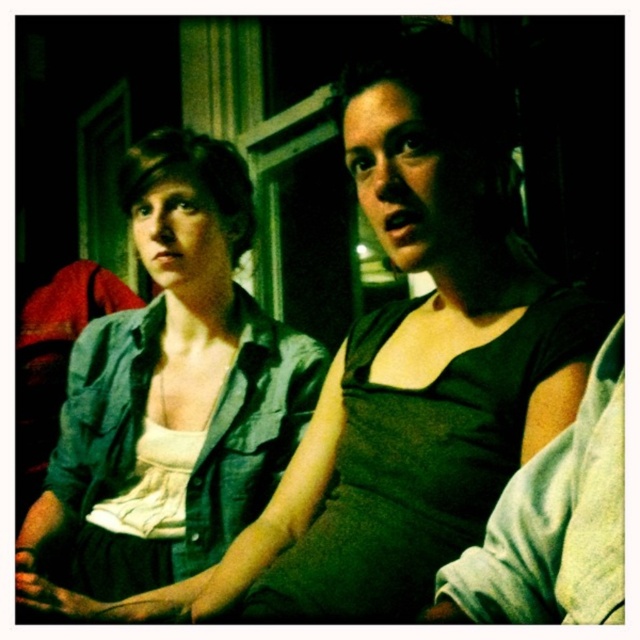
You are a fashion designer analyzing the image. You need to determine which item, the denim shirt at left or the dark green fabric at center, has a greater height in the image. Based on the scene, which one is taller?

The denim shirt at left is taller than the dark green fabric at center according to the description.

What is the 2D coordinate of the denim shirt at left in the image?

The denim shirt at left is located at the 2D coordinate point of (168, 403).

You are standing in the room and want to hand a small note to the person wearing the dark green fabric at center without disturbing the person in the denim shirt at left. How can you approach them?

The denim shirt at left is positioned on the left side of dark green fabric at center, so you can approach the dark green fabric at center from the right side to avoid disturbing the person in the denim shirt at left.